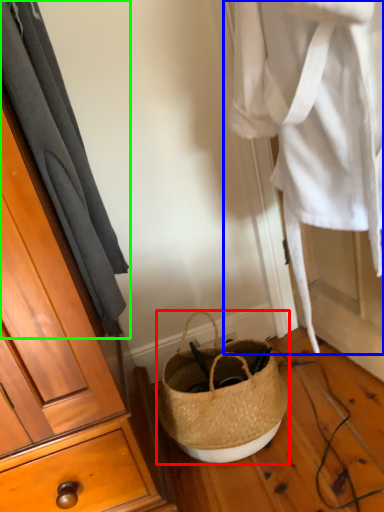
Question: Based on their relative distances, which object is farther from handbag (highlighted by a red box)? Choose from clothing (highlighted by a blue box) and curtain (highlighted by a green box).

Choices:
 (A) clothing
 (B) curtain

Answer: (B)